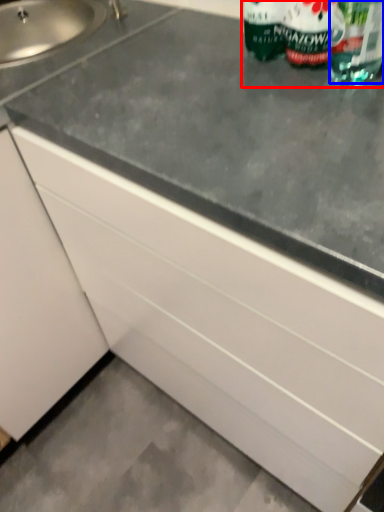
Question: Which object appears closest to the camera in this image, bottle (highlighted by a red box) or drinking straw (highlighted by a blue box)?

Choices:
 (A) bottle
 (B) drinking straw

Answer: (B)